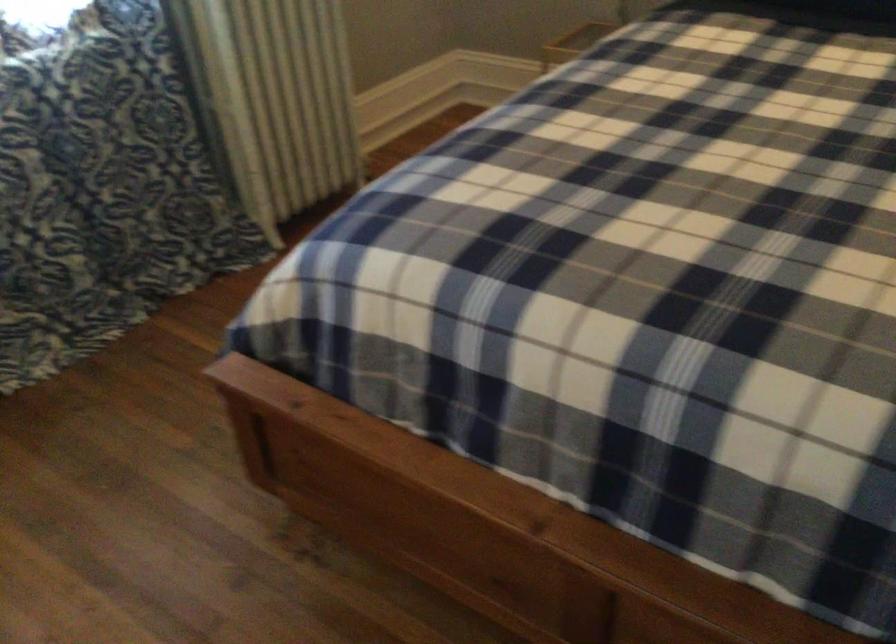
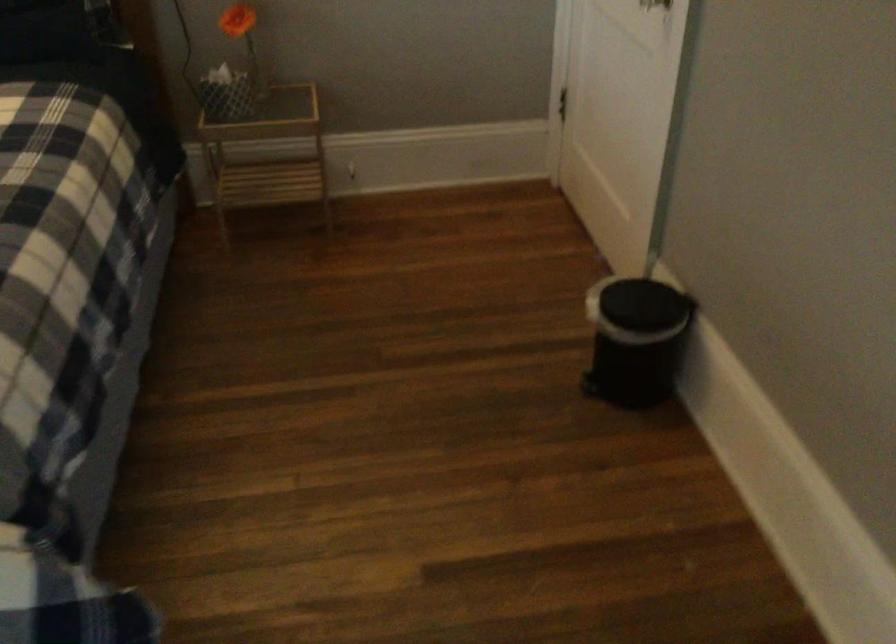
Question: The camera is either moving clockwise (left) or counter-clockwise (right) around the object. The first image is from the beginning of the video and the second image is from the end. Is the camera moving left or right when shooting the video?

Choices:
 (A) Left
 (B) Right

Answer: (A)